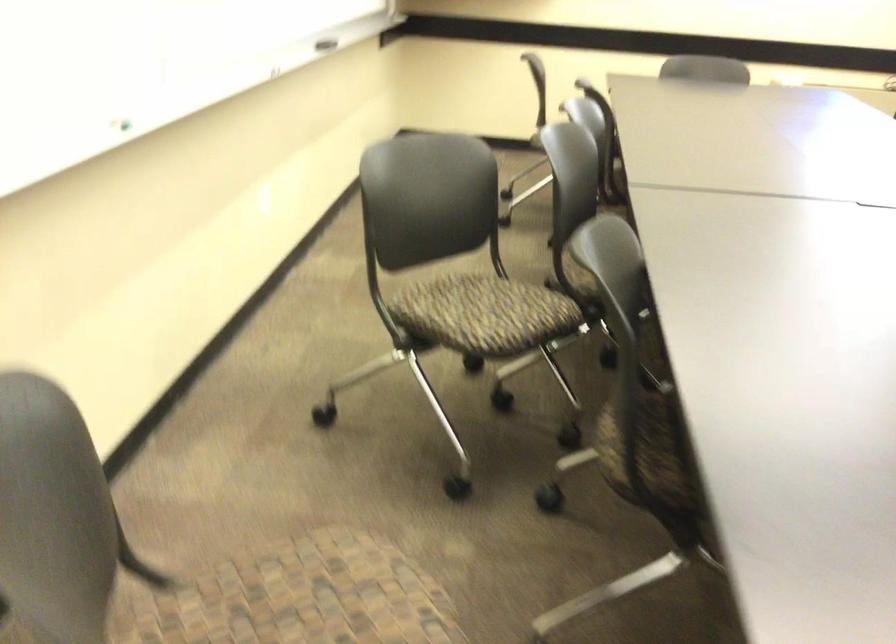
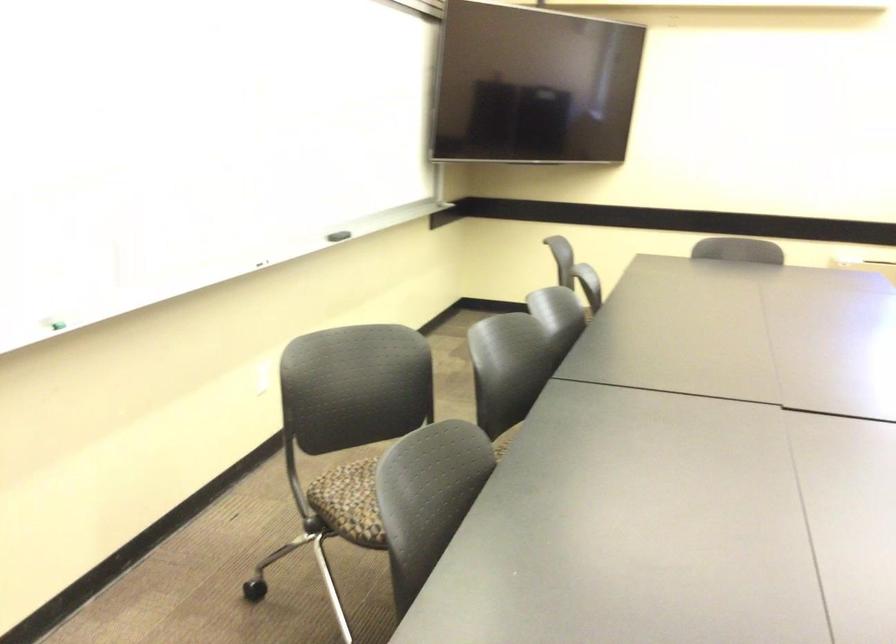
Find the pixel in the second image that matches point (449, 317) in the first image.

(350, 502)